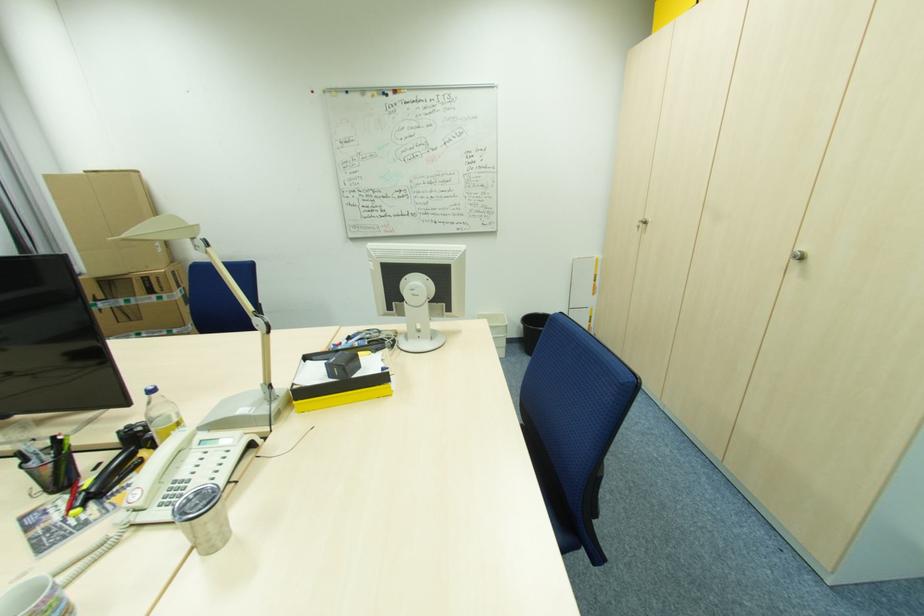
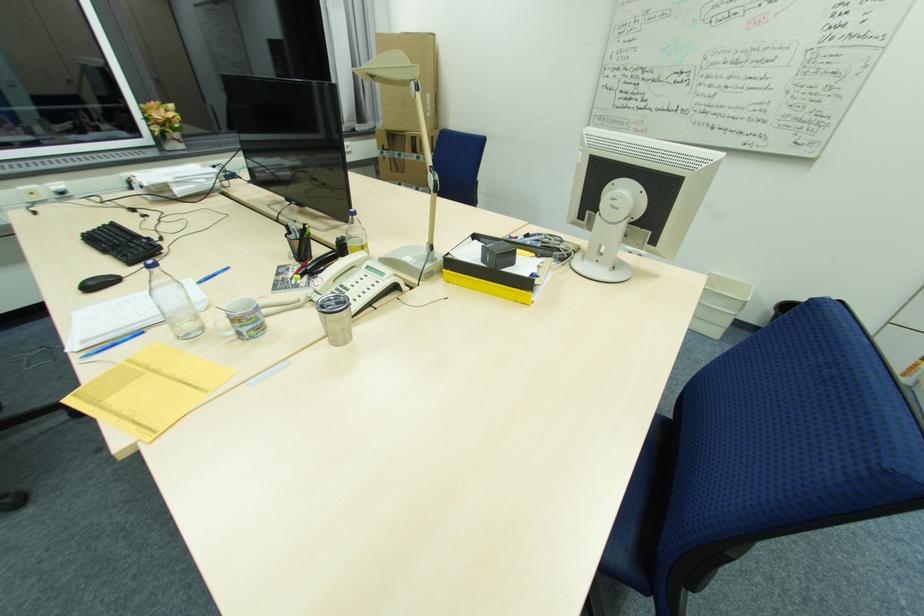
The point at (79,511) is marked in the first image. Where is the corresponding point in the second image?

(301, 276)